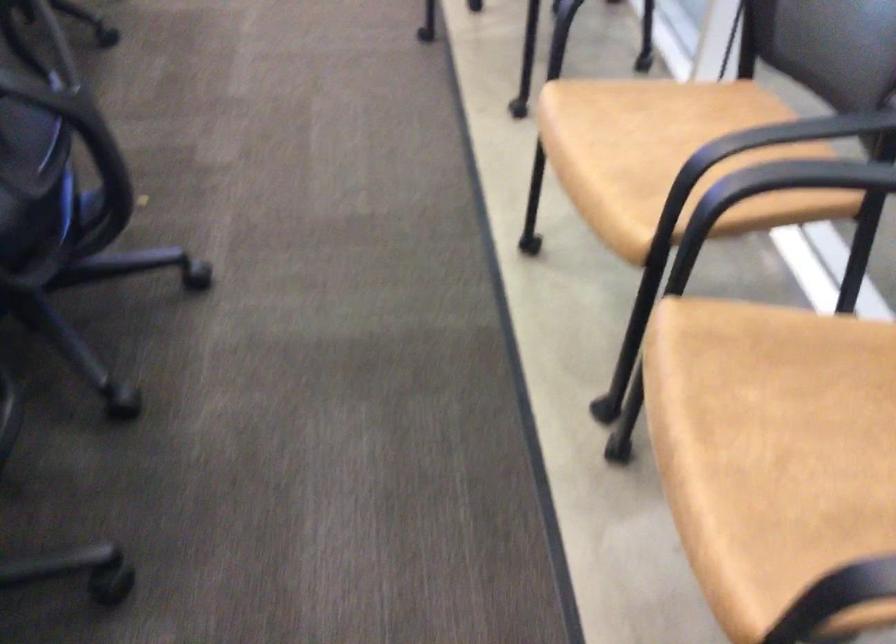
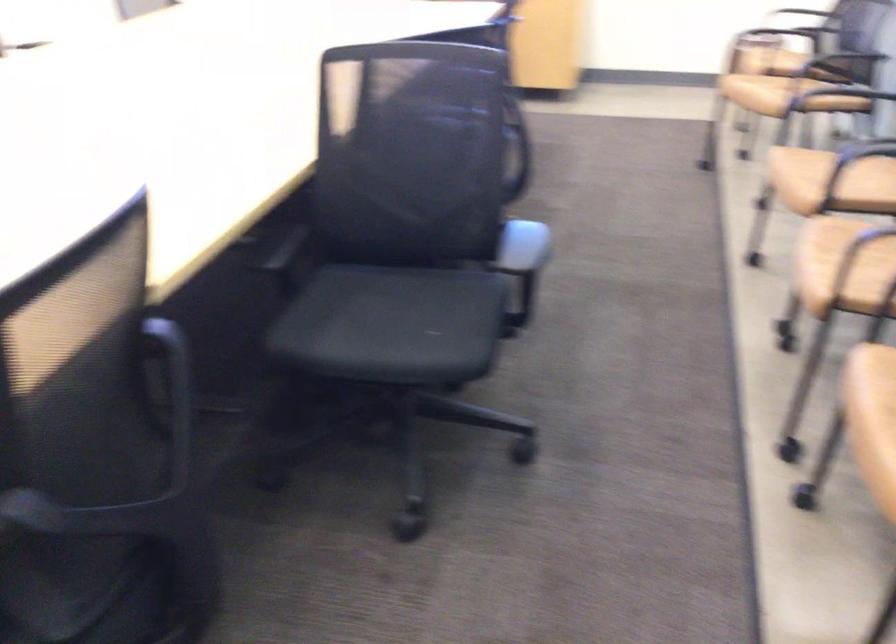
The point at (737, 408) is marked in the first image. Where is the corresponding point in the second image?

(842, 242)